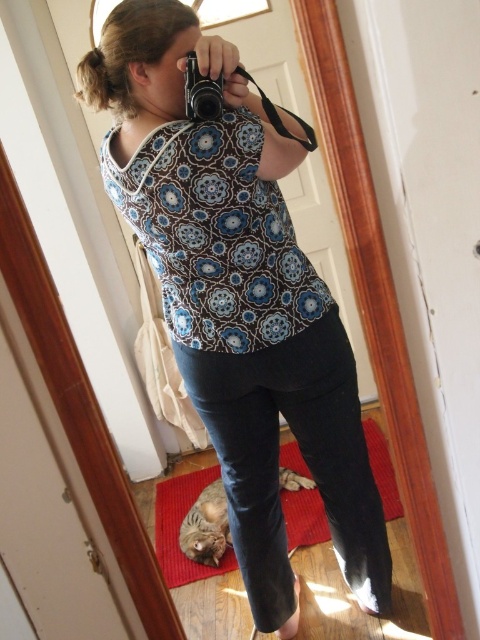
Question: Is patterned fabric blouse at center to the right of black plastic camera at upper center from the viewer's perspective?

Choices:
 (A) no
 (B) yes

Answer: (B)

Question: Among these points, which one is nearest to the camera?

Choices:
 (A) (215, 120)
 (B) (204, 138)

Answer: (A)

Question: Is patterned fabric blouse at center below black plastic camera at upper center?

Choices:
 (A) yes
 (B) no

Answer: (A)

Question: Which object appears closest to the camera in this image?

Choices:
 (A) patterned fabric blouse at center
 (B) black plastic camera at upper center

Answer: (B)

Question: Is patterned fabric blouse at center thinner than black plastic camera at upper center?

Choices:
 (A) no
 (B) yes

Answer: (A)